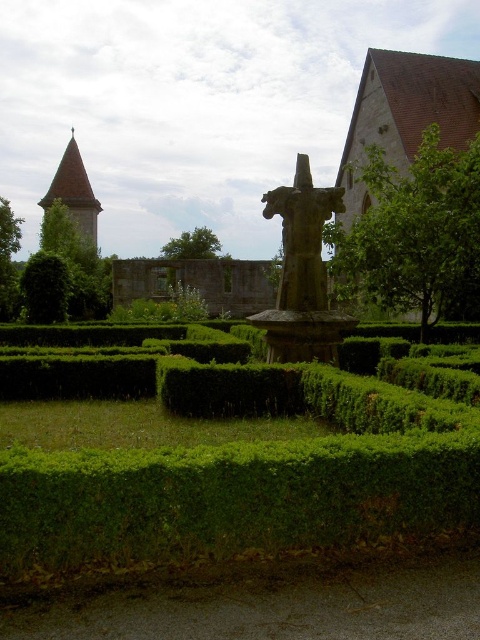
In the scene shown: You are a visitor in the garden and want to take a photo of both the green leafy tree at upper right and the green leafy tree at center. Which tree should you stand closer to in order to fit both into the frame?

You should stand closer to the green leafy tree at center because it is smaller than the green leafy tree at upper right. By positioning yourself nearer to the smaller tree, you can include both trees within the camera frame more effectively.

You are standing at the camera position in the garden scene. There is a green leafy bush at left. Can you reach it within 2 minutes if you walk at a normal pace of 3 feet per second?

The green leafy bush at left is 173.80 feet away from camera. Walking at 3 feet per second, it would take approximately 58 seconds, which is under 2 minutes. Yes, you can reach it within 2 minutes.